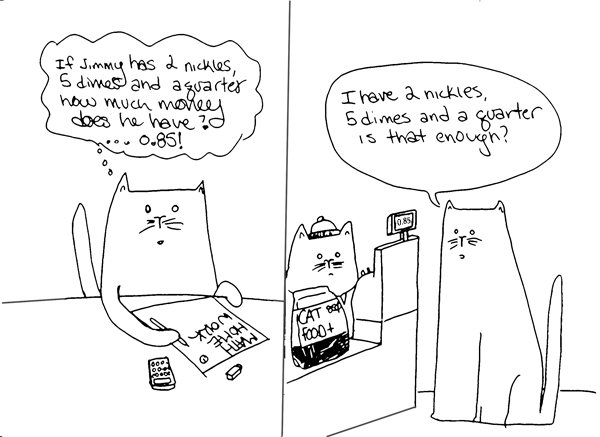
What are the coordinates of `cash register` in the screenshot? It's located at (390, 292).